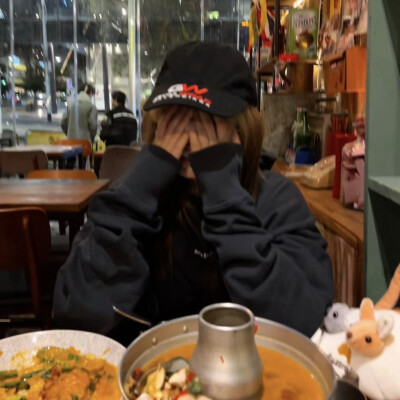
You are a GUI agent. You are given a task and a screenshot of the screen. Output one action in this format:
    pyautogui.click(x=<x>, y=<y>)
    Task: Click on the bowl of food
    
    Given the screenshot: What is the action you would take?
    click(x=56, y=362)